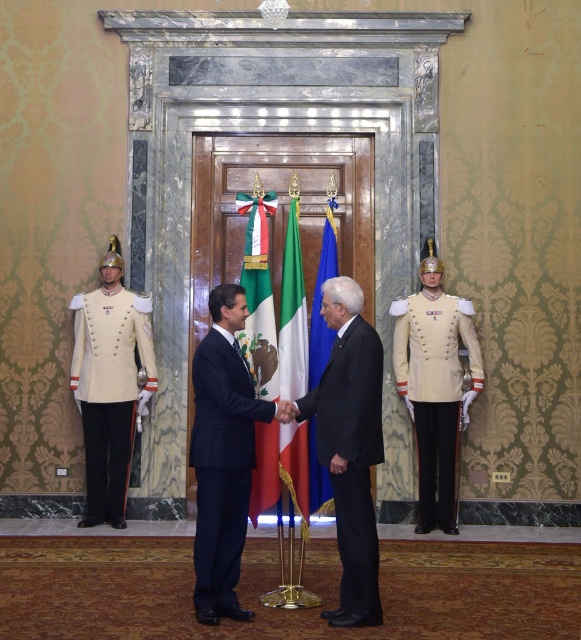
Does navy blue suit at center appear under blue fabric flag at center?

Yes, navy blue suit at center is below blue fabric flag at center.

Is point (229, 388) closer to viewer compared to point (322, 259)?

Yes, it is in front of point (322, 259).

Where is `navy blue suit at center`? navy blue suit at center is located at coordinates (221, 465).

Does point (127, 371) come in front of point (421, 332)?

No.

Does cream matte uniform at left have a greater width compared to light beige fabric uniform at right?

No, cream matte uniform at left is not wider than light beige fabric uniform at right.

Measure the distance between cream matte uniform at left and camera.

cream matte uniform at left is 8.05 meters from camera.

Where is `cream matte uniform at left`? cream matte uniform at left is located at coordinates (109, 390).

Which is behind, point (105, 394) or point (315, 353)?

Positioned behind is point (105, 394).

In the scene shown: Who is taller, cream matte uniform at left or blue fabric flag at center?

With more height is blue fabric flag at center.

Who is more forward, (84,403) or (324,499)?

Point (324,499) is more forward.

Locate an element on the screen. The image size is (581, 640). cream matte uniform at left is located at coordinates (109, 390).